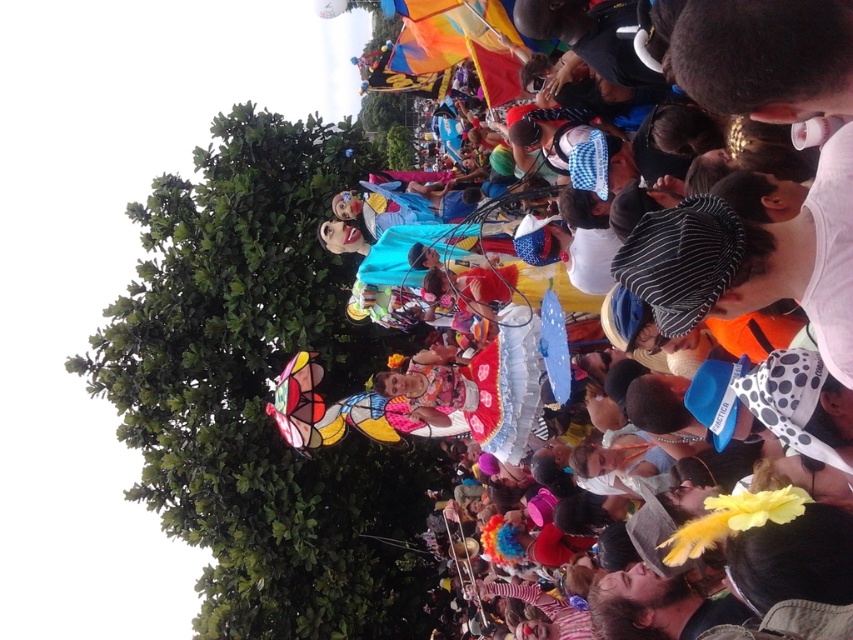
Which is more to the left, green leafy tree at upper left or matte colorful costumes at center?

green leafy tree at upper left is more to the left.

Consider the image. Does green leafy tree at upper left appear over matte colorful costumes at center?

Actually, green leafy tree at upper left is below matte colorful costumes at center.

Who is more forward, (x=323, y=124) or (x=675, y=237)?

Positioned in front is point (x=675, y=237).

At what (x,y) coordinates should I click in order to perform the action: click on green leafy tree at upper left. Please return your answer as a coordinate pair (x, y). Looking at the image, I should click on (262, 394).